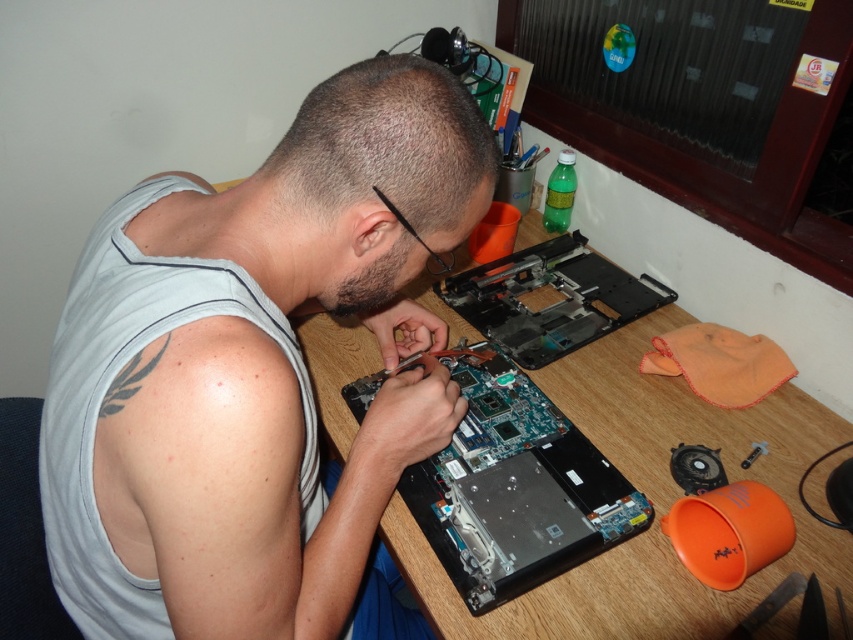
Question: Estimate the real-world distances between objects in this image. Which object is farther from the blue circuit board at center?

Choices:
 (A) wooden table at center
 (B) black plastic laptop at center
 (C) gray matte tank top at center

Answer: (C)

Question: Can you confirm if gray matte tank top at center is smaller than black plastic laptop at center?

Choices:
 (A) yes
 (B) no

Answer: (B)

Question: Which point appears farthest from the camera in this image?

Choices:
 (A) (178, 336)
 (B) (502, 444)
 (C) (434, 284)

Answer: (C)

Question: Does wooden table at center appear on the right side of blue circuit board at center?

Choices:
 (A) no
 (B) yes

Answer: (B)

Question: Which object is closer to the camera taking this photo?

Choices:
 (A) blue circuit board at center
 (B) black plastic laptop at center

Answer: (A)

Question: Observing the image, what is the correct spatial positioning of wooden table at center in reference to black plastic laptop at center?

Choices:
 (A) left
 (B) right

Answer: (A)